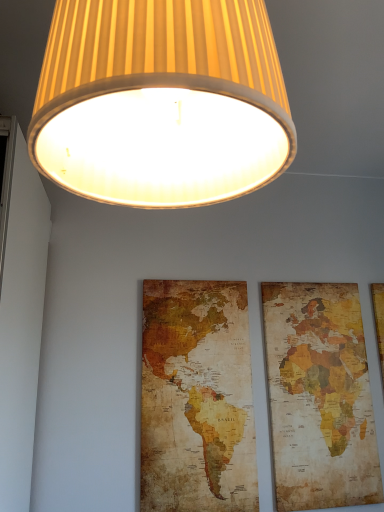
Question: Is vintage paper map at right not within matte yellow fabric lampshade at upper center?

Choices:
 (A) no
 (B) yes

Answer: (B)

Question: Can you confirm if vintage paper map at right is smaller than matte yellow fabric lampshade at upper center?

Choices:
 (A) no
 (B) yes

Answer: (B)

Question: From the image's perspective, is vintage paper map at right located beneath matte yellow fabric lampshade at upper center?

Choices:
 (A) yes
 (B) no

Answer: (A)

Question: Can you confirm if vintage paper map at right is bigger than matte yellow fabric lampshade at upper center?

Choices:
 (A) yes
 (B) no

Answer: (B)

Question: Does vintage paper map at right come in front of matte yellow fabric lampshade at upper center?

Choices:
 (A) yes
 (B) no

Answer: (B)

Question: Is vintage paper map at right at the right side of matte yellow fabric lampshade at upper center?

Choices:
 (A) no
 (B) yes

Answer: (B)

Question: Is vintage paper map at center bigger than vintage paper map at right?

Choices:
 (A) yes
 (B) no

Answer: (A)

Question: Does vintage paper map at center have a lesser width compared to vintage paper map at right?

Choices:
 (A) no
 (B) yes

Answer: (A)

Question: Does vintage paper map at center lie behind vintage paper map at right?

Choices:
 (A) no
 (B) yes

Answer: (A)

Question: Can vintage paper map at right be found inside vintage paper map at center?

Choices:
 (A) no
 (B) yes

Answer: (A)

Question: Are vintage paper map at center and vintage paper map at right making contact?

Choices:
 (A) no
 (B) yes

Answer: (A)

Question: Can you confirm if vintage paper map at center is smaller than vintage paper map at right?

Choices:
 (A) no
 (B) yes

Answer: (A)

Question: Is matte yellow fabric lampshade at upper center to the right of vintage paper map at center from the viewer's perspective?

Choices:
 (A) yes
 (B) no

Answer: (B)